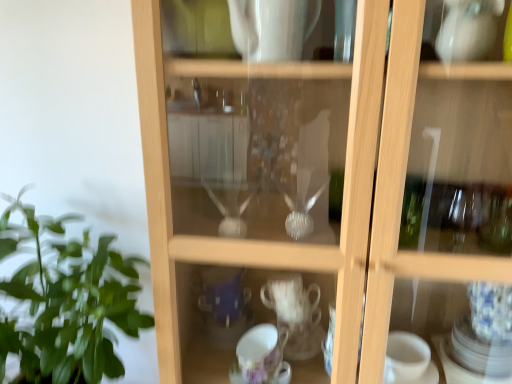
Question: In terms of size, does transparent glass cup at center appear bigger or smaller than green leafy plant at left?

Choices:
 (A) big
 (B) small

Answer: (A)

Question: In terms of width, does transparent glass cup at center look wider or thinner when compared to green leafy plant at left?

Choices:
 (A) thin
 (B) wide

Answer: (A)

Question: Do you think transparent glass cup at center is within green leafy plant at left, or outside of it?

Choices:
 (A) inside
 (B) outside

Answer: (B)

Question: Is green leafy plant at left wider or thinner than transparent glass cup at center?

Choices:
 (A) thin
 (B) wide

Answer: (B)

Question: In the image, is green leafy plant at left positioned in front of or behind transparent glass cup at center?

Choices:
 (A) front
 (B) behind

Answer: (B)

Question: From their relative heights in the image, would you say green leafy plant at left is taller or shorter than transparent glass cup at center?

Choices:
 (A) short
 (B) tall

Answer: (A)

Question: Is green leafy plant at left inside the boundaries of transparent glass cup at center, or outside?

Choices:
 (A) outside
 (B) inside

Answer: (A)